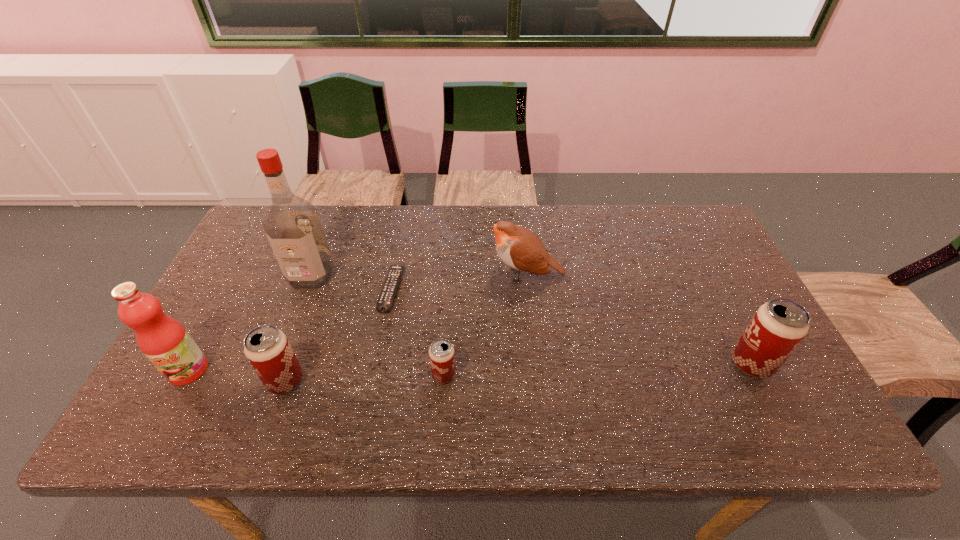
I want to click on the leftmost object, so click(x=164, y=341).

Image resolution: width=960 pixels, height=540 pixels. Identify the location of vacant space located on the right of the leftmost beer can. (363, 381).

Find the location of `blank area located on the right of the sixth tallest object`. blank area located on the right of the sixth tallest object is located at coordinates (486, 375).

The height and width of the screenshot is (540, 960). I want to click on vacant space located 0.350m on the left of the rightmost beer can, so click(x=586, y=364).

What are the coordinates of `vacant area located on the front-facing side of the liquor` in the screenshot? It's located at (300, 303).

Where is `free point located at the face of the second object from right to left`? free point located at the face of the second object from right to left is located at coordinates (349, 275).

Locate an element on the screen. This screenshot has height=540, width=960. vacant space positioned at the face of the second object from right to left is located at coordinates (352, 275).

You are a GUI agent. You are given a task and a screenshot of the screen. Output one action in this format:
    pyautogui.click(x=<x>, y=<y>)
    Task: Click on the vacant region located 0.270m at the face of the second object from right to left
    
    Given the screenshot: What is the action you would take?
    click(x=394, y=275)

At what (x,y) coordinates should I click in order to perform the action: click on free space located on the right of the remote control. Please return your answer as a coordinate pair (x, y). The image size is (960, 540). Looking at the image, I should click on (493, 289).

I want to click on fruit juice that is at the near edge, so click(x=164, y=341).